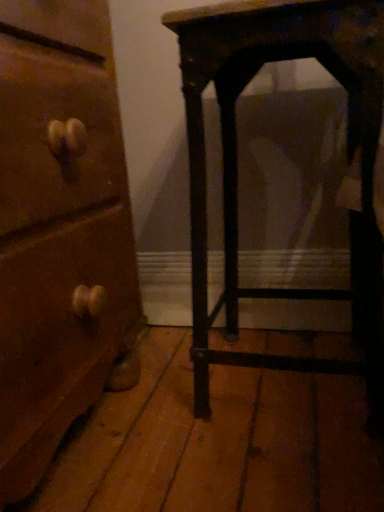
You are a GUI agent. You are given a task and a screenshot of the screen. Output one action in this format:
    pyautogui.click(x=<x>, y=<y>)
    Task: Click on the vacant space that's between wooden chest of drawers at left and dark wood table at right
    This screenshot has height=512, width=384.
    Given the screenshot: What is the action you would take?
    pyautogui.click(x=225, y=429)